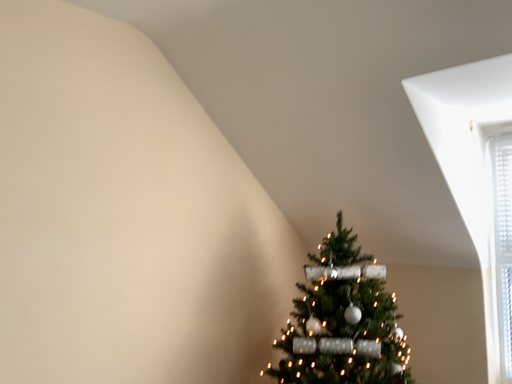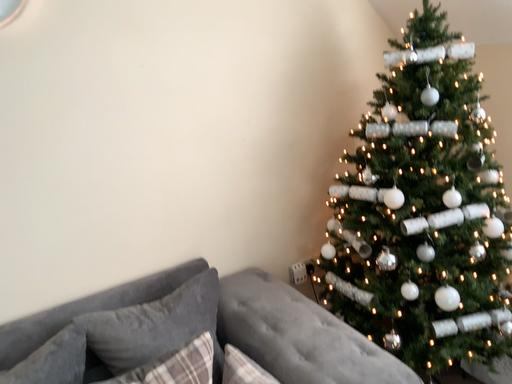
Question: How did the camera likely rotate when shooting the video?

Choices:
 (A) rotated downward
 (B) rotated upward

Answer: (A)